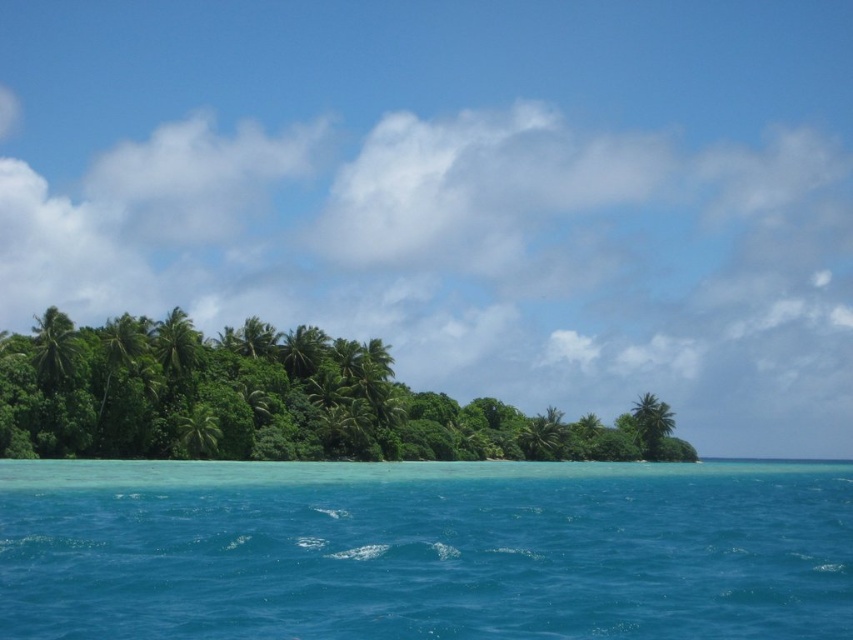
Question: Considering the real-world distances, which object is closest to the green leafy trees at center?

Choices:
 (A) clear blue water at center
 (B) green leafy palm tree at center

Answer: (A)

Question: Does clear blue water at center have a lesser width compared to green leafy trees at center?

Choices:
 (A) no
 (B) yes

Answer: (B)

Question: Considering the real-world distances, which object is closest to the green leafy trees at center?

Choices:
 (A) green leafy palm tree at center
 (B) green leafy palm tree at left
 (C) clear blue water at center

Answer: (C)

Question: Is clear blue water at center to the left of green leafy palm tree at left from the viewer's perspective?

Choices:
 (A) no
 (B) yes

Answer: (A)

Question: Does clear blue water at center have a lesser width compared to green leafy trees at center?

Choices:
 (A) yes
 (B) no

Answer: (A)

Question: Which object is closer to the camera taking this photo?

Choices:
 (A) green leafy trees at center
 (B) green leafy palm tree at center
 (C) clear blue water at center

Answer: (C)